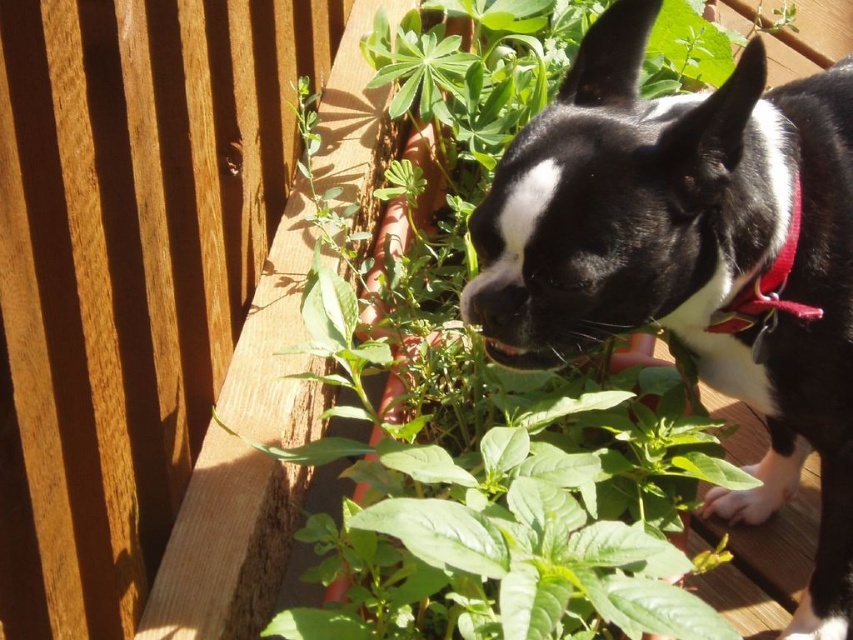
Is black matte dog at center shorter than red fabric neckband at upper right?

Incorrect, black matte dog at center's height does not fall short of red fabric neckband at upper right's.

Identify the location of black matte dog at center. (689, 257).